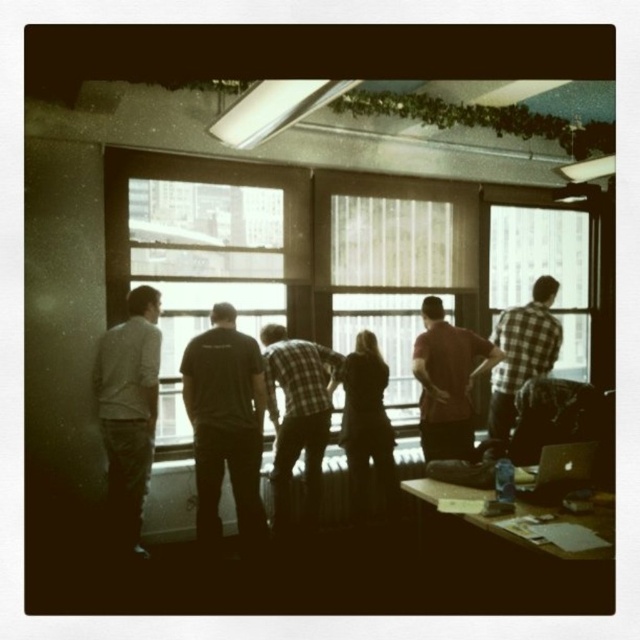
Does black cotton shirt at center come behind plaid fabric shirt at center?

That is False.

Does point (212, 413) come behind point (264, 369)?

No, it is not.

I want to click on black cotton shirt at center, so click(225, 422).

Is point (250, 342) closer to camera compared to point (480, 356)?

Yes.

Who is more distant from viewer, (243, 426) or (472, 381)?

Point (472, 381)

Identify the location of black cotton shirt at center. (225, 422).

From the picture: Who is more forward, (236, 369) or (545, 264)?

Point (236, 369) is more forward.

Is black cotton shirt at center above clear glass window at center?

No, black cotton shirt at center is not above clear glass window at center.

Is point (224, 340) farther from viewer compared to point (513, 291)?

No, (224, 340) is in front of (513, 291).

Find the location of a particular element. The image size is (640, 640). black cotton shirt at center is located at coordinates (225, 422).